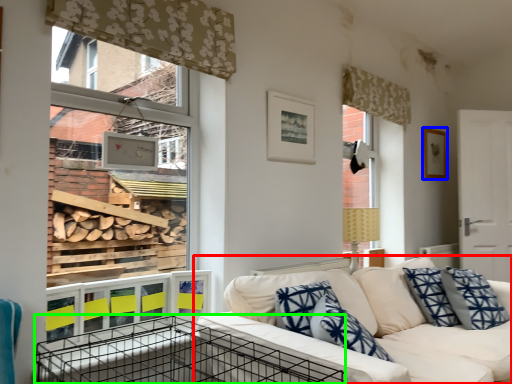
Question: Estimate the real-world distances between objects in this image. Which object is farther from studio couch (highlighted by a red box), picture frame (highlighted by a blue box) or crate (highlighted by a green box)?

Choices:
 (A) picture frame
 (B) crate

Answer: (A)